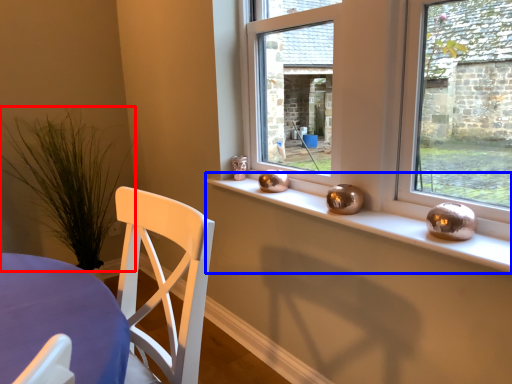
Question: Which object is further to the camera taking this photo, plant (highlighted by a red box) or window sill (highlighted by a blue box)?

Choices:
 (A) plant
 (B) window sill

Answer: (A)